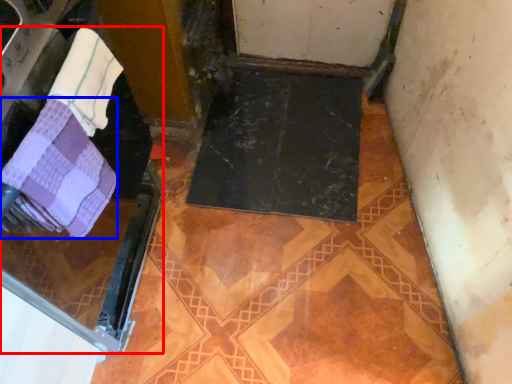
Question: Which point is closer to the camera, screen door (highlighted by a red box) or towel (highlighted by a blue box)?

Choices:
 (A) screen door
 (B) towel

Answer: (A)